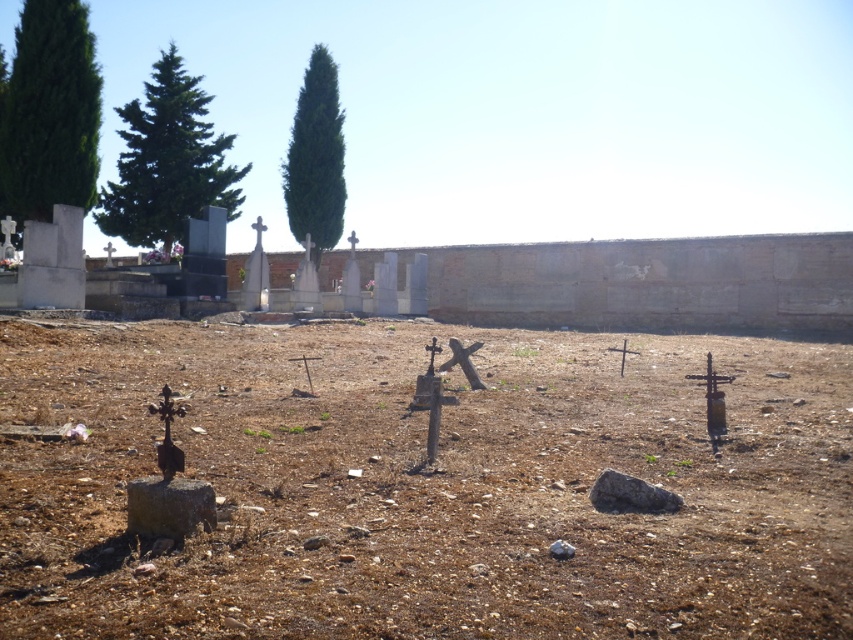
You are standing in the cemetery and want to walk from the green leafy tree at upper left to the brown dirt field at center. Which direction should you move relative to the tree?

You should move downward from the green leafy tree at upper left to reach the brown dirt field at center since the brown dirt field at center is located below the green leafy tree at upper left.

You are standing in the cemetery and want to know which object is taller between the brown dirt field at center and the green leafy tree at upper left. Based on the scene, can you determine which one is taller?

The green leafy tree at upper left is taller than the brown dirt field at center.